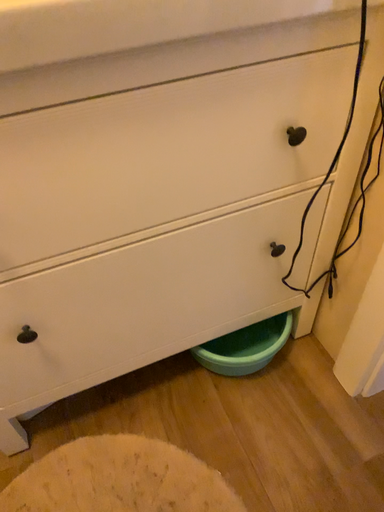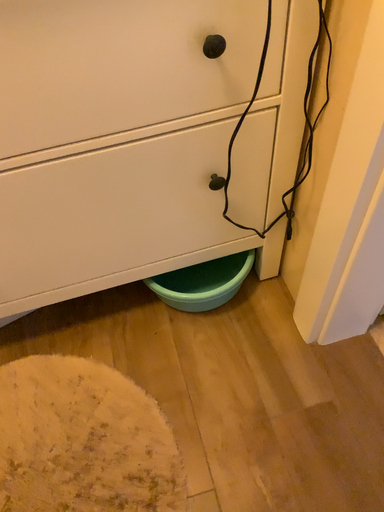
Question: Which way did the camera rotate in the video?

Choices:
 (A) rotated left
 (B) rotated right

Answer: (A)